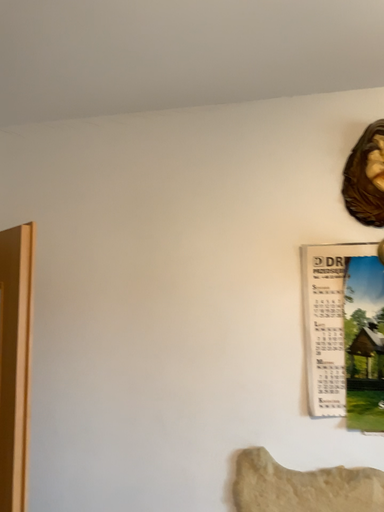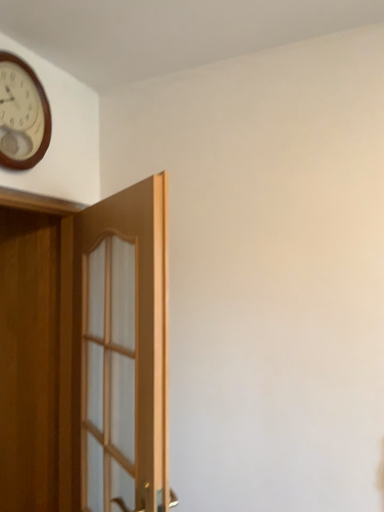
Question: How did the camera likely rotate when shooting the video?

Choices:
 (A) rotated left
 (B) rotated right

Answer: (A)